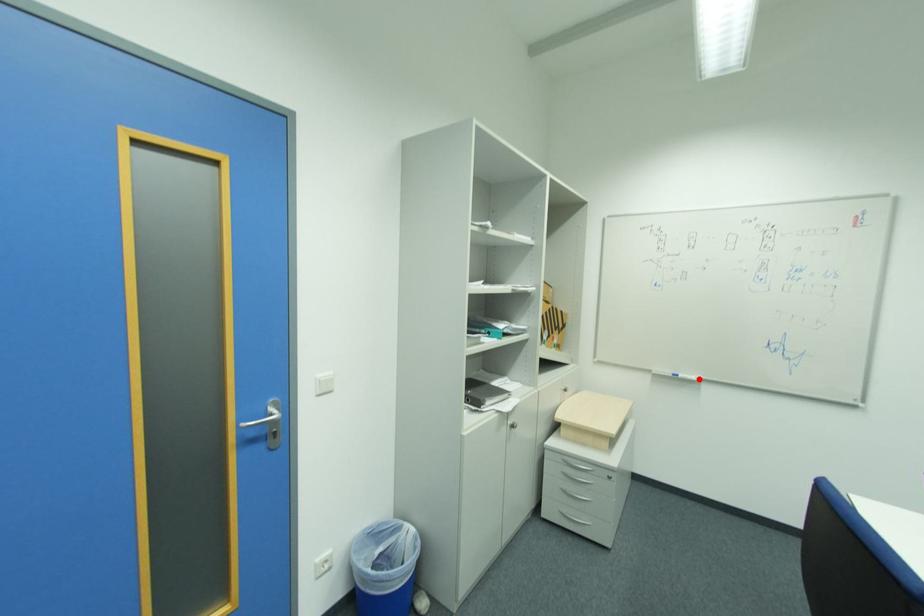
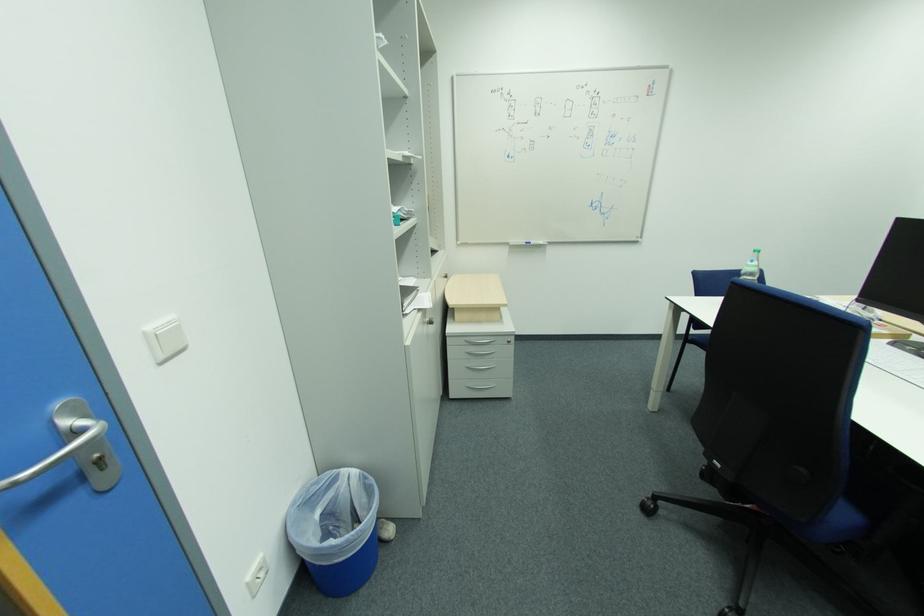
The point at the highlighted location is marked in the first image. Where is the corresponding point in the second image?

(546, 244)